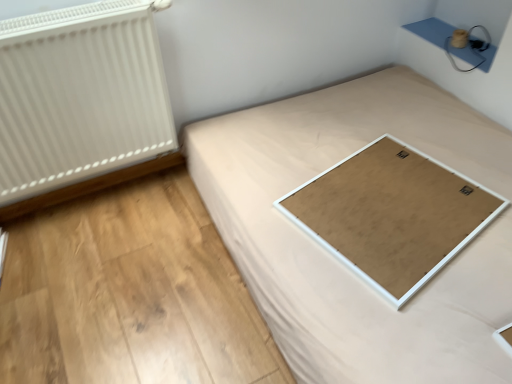
Question: From the image's perspective, would you say white matte board at center is positioned over white textured radiator at left?

Choices:
 (A) no
 (B) yes

Answer: (A)

Question: Can you confirm if white matte board at center is positioned to the right of white textured radiator at left?

Choices:
 (A) yes
 (B) no

Answer: (A)

Question: Can you confirm if white matte board at center is bigger than white textured radiator at left?

Choices:
 (A) yes
 (B) no

Answer: (A)

Question: Is white matte board at center facing towards white textured radiator at left?

Choices:
 (A) yes
 (B) no

Answer: (B)

Question: Considering the relative sizes of white matte board at center and white textured radiator at left in the image provided, is white matte board at center smaller than white textured radiator at left?

Choices:
 (A) yes
 (B) no

Answer: (B)

Question: In terms of size, does white matte board at center appear bigger or smaller than white textured radiator at left?

Choices:
 (A) small
 (B) big

Answer: (A)

Question: Would you say white matte board at center is inside or outside white textured radiator at left?

Choices:
 (A) inside
 (B) outside

Answer: (B)

Question: From the image's perspective, is white matte board at center positioned above or below white textured radiator at left?

Choices:
 (A) above
 (B) below

Answer: (B)

Question: Considering the positions of white matte board at center and white textured radiator at left in the image, is white matte board at center taller or shorter than white textured radiator at left?

Choices:
 (A) tall
 (B) short

Answer: (B)

Question: Is white matte board at center taller or shorter than white textured radiator at left?

Choices:
 (A) short
 (B) tall

Answer: (A)

Question: Based on their sizes in the image, would you say white matte board at center is bigger or smaller than white textured radiator at left?

Choices:
 (A) big
 (B) small

Answer: (A)

Question: In terms of width, does white matte board at center look wider or thinner when compared to white textured radiator at left?

Choices:
 (A) thin
 (B) wide

Answer: (B)

Question: From the image's perspective, relative to white textured radiator at left, is white matte board at center above or below?

Choices:
 (A) above
 (B) below

Answer: (B)

Question: From the image's perspective, is natural wood plywood at lower center above or below white matte board at center?

Choices:
 (A) below
 (B) above

Answer: (A)

Question: From a real-world perspective, is natural wood plywood at lower center above or below white matte board at center?

Choices:
 (A) above
 (B) below

Answer: (B)